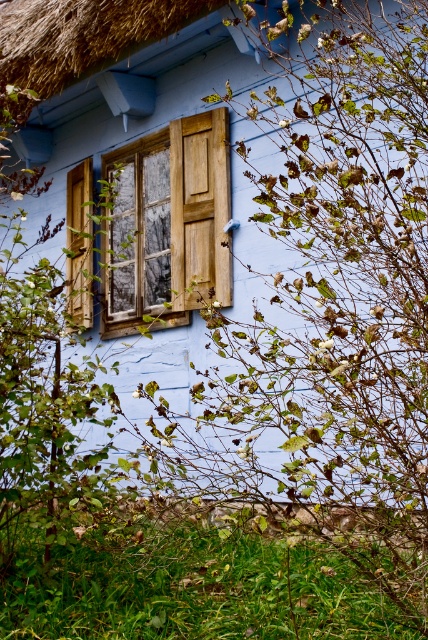
You are a painter standing on a ladder near the wooden at left. You want to touch the thatched straw roof at upper center with your brush. Can you reach it without moving the ladder?

The distance between the thatched straw roof at upper center and the wooden at left is 3.41 feet. Since you are on a ladder near the wooden at left, you can extend your arm to reach the thatched straw roof at upper center if your arm length plus the ladder height allows it, but the horizontal distance is 3.41 feet. However, without knowing the ladder height or your arm length, we can only state the distance between them.

You are standing in front of the rustic blue house. You notice the thatched straw roof at upper center and the wooden at left. Which object is positioned higher in the image?

The thatched straw roof at upper center is positioned higher than the wooden at left as it is located above it.